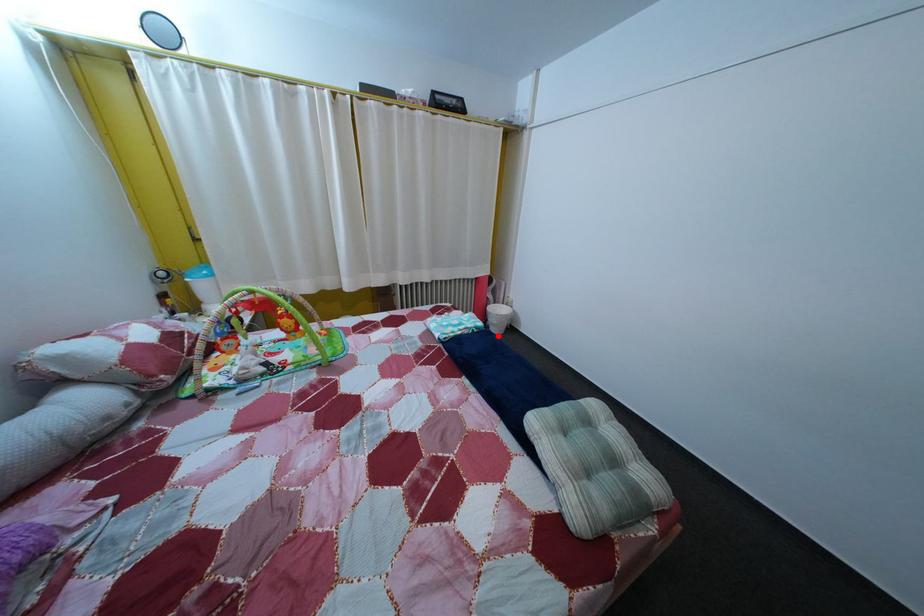
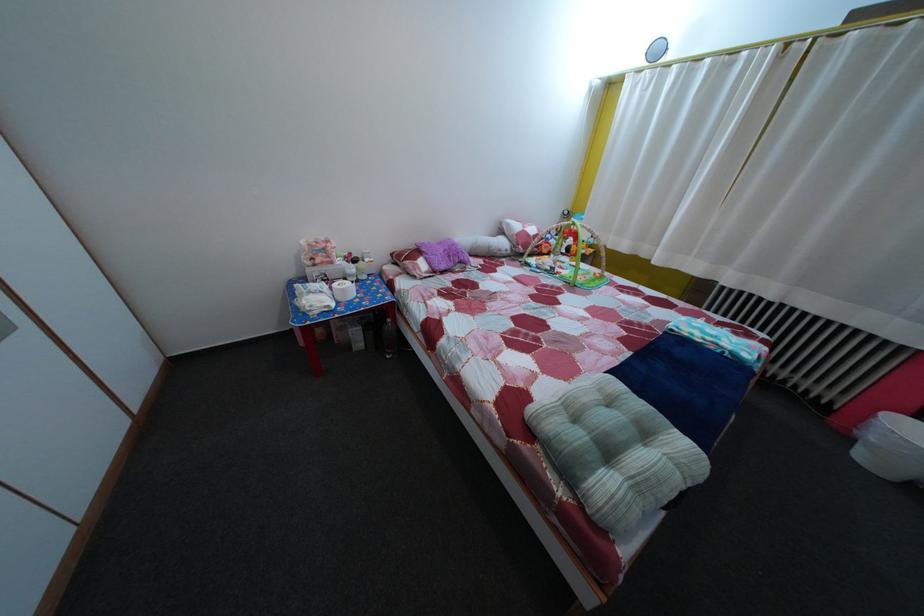
Question: I am providing you with two images of the same scene from different viewpoints. Image1 has a red point marked. In image2, the corresponding 3D location appears at what relative position? Reply with the corresponding letter.

Choices:
 (A) Closer
 (B) Farther

Answer: (B)